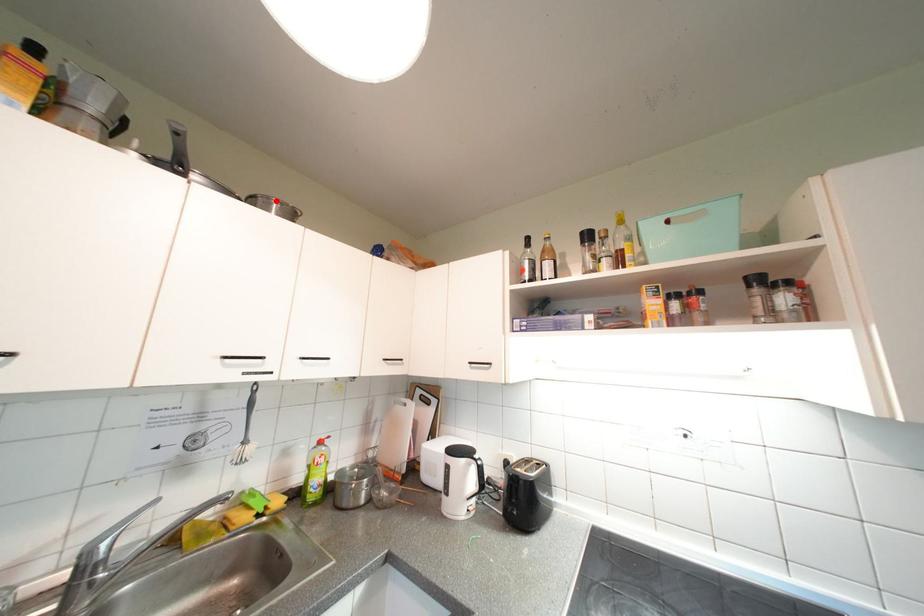
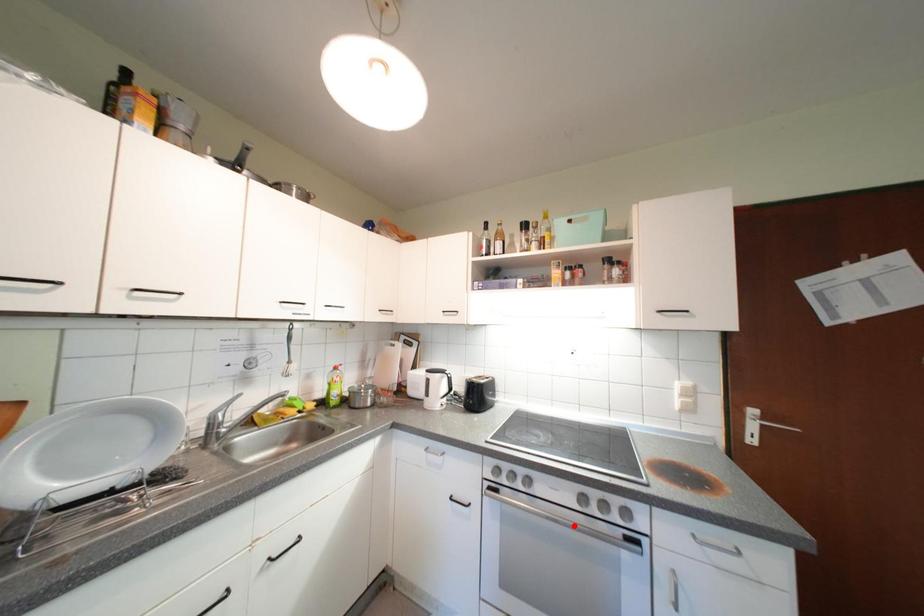
I am providing you with two images of the same scene from different viewpoints. A red point is marked on the first image and another point is marked on the second image. Do the highlighted points in image1 and image2 indicate the same real-world spot?

No